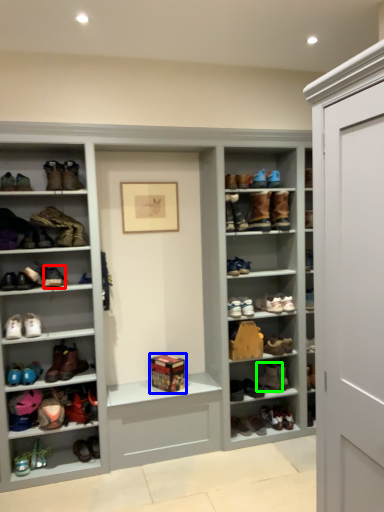
Question: Which object is positioned farthest from footwear (highlighted by a red box)? Select from box (highlighted by a blue box) and footwear (highlighted by a green box).

Choices:
 (A) box
 (B) footwear

Answer: (B)